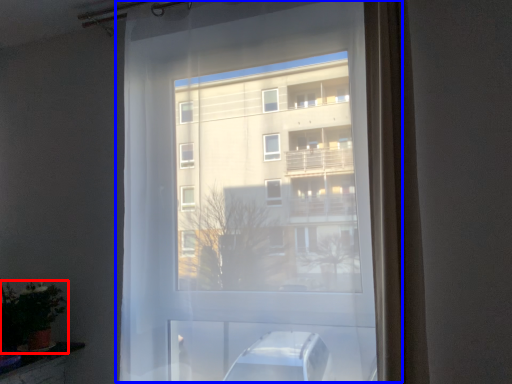
Question: Which point is further to the camera, houseplant (highlighted by a red box) or window (highlighted by a blue box)?

Choices:
 (A) houseplant
 (B) window

Answer: (A)